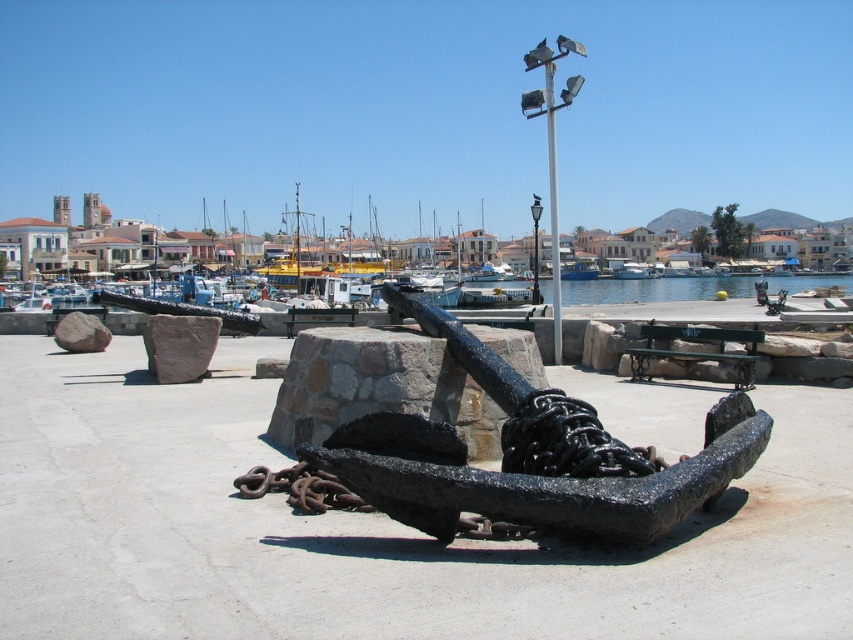
Question: Can you confirm if black metallic chain at center is positioned below metallic pole at upper center?

Choices:
 (A) no
 (B) yes

Answer: (B)

Question: Which object is positioned farthest from the black metallic chain at center?

Choices:
 (A) blue glossy boat at center
 (B) rusty metal chain at center
 (C) metallic pole at upper center

Answer: (A)

Question: Which of these objects is positioned farthest from the rusty metal chain at center?

Choices:
 (A) brown rough stone at center
 (B) blue glossy boat at center
 (C) blue water at center

Answer: (C)

Question: Does blue water at center have a smaller size compared to rusty metal chain at center?

Choices:
 (A) no
 (B) yes

Answer: (A)

Question: Is brown rough stone at center thinner than gray rough rock at center?

Choices:
 (A) no
 (B) yes

Answer: (A)

Question: Considering the real-world distances, which object is farthest from the metallic pole at upper center?

Choices:
 (A) brown rough stone at center
 (B) blue water at center
 (C) black metallic chain at center
 (D) gray rough rock at center

Answer: (B)